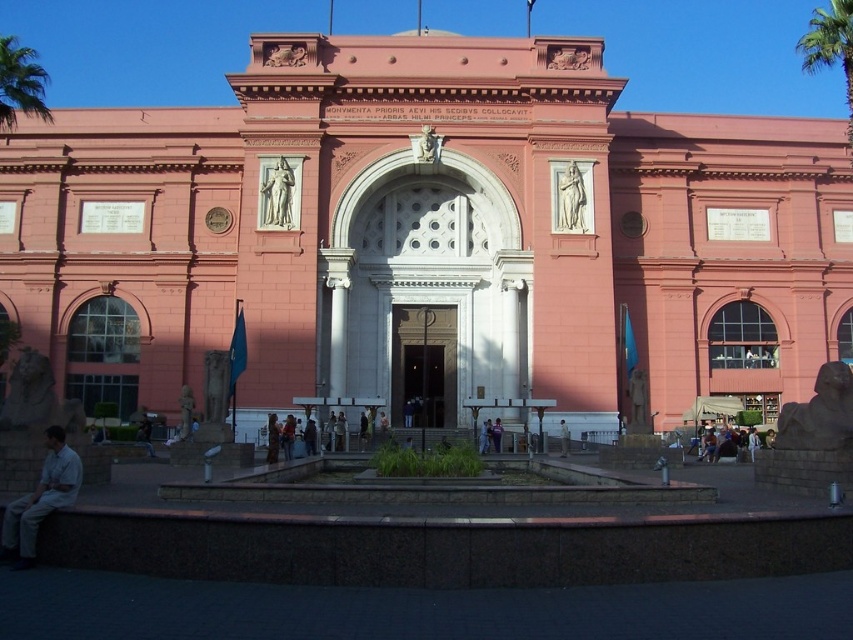
Between point (0, 74) and point (285, 417), which one is positioned in front?

Point (0, 74)

Can you confirm if green leafy palm tree at upper left is positioned below denim jacket at center?

Actually, green leafy palm tree at upper left is above denim jacket at center.

Which is in front, point (19, 76) or point (283, 442)?

Point (283, 442)

The width and height of the screenshot is (853, 640). I want to click on green leafy palm tree at upper left, so click(20, 83).

Does light brown wooden bench at lower center have a lesser height compared to denim jacket at center?

Yes, light brown wooden bench at lower center is shorter than denim jacket at center.

Between light brown wooden bench at lower center and denim jacket at center, which one has less height?

light brown wooden bench at lower center

Is point (726, 429) positioned in front of point (286, 442)?

No, it is behind (286, 442).

This screenshot has height=640, width=853. Identify the location of light brown wooden bench at lower center. (727, 444).

Between green leafy palm tree at upper left and green leafy palm tree at upper right, which one appears on the right side from the viewer's perspective?

green leafy palm tree at upper right

Is point (16, 45) closer to camera compared to point (805, 60)?

That is False.

You are a GUI agent. You are given a task and a screenshot of the screen. Output one action in this format:
    pyautogui.click(x=<x>, y=<y>)
    Task: Click on the green leafy palm tree at upper left
    
    Given the screenshot: What is the action you would take?
    pyautogui.click(x=20, y=83)